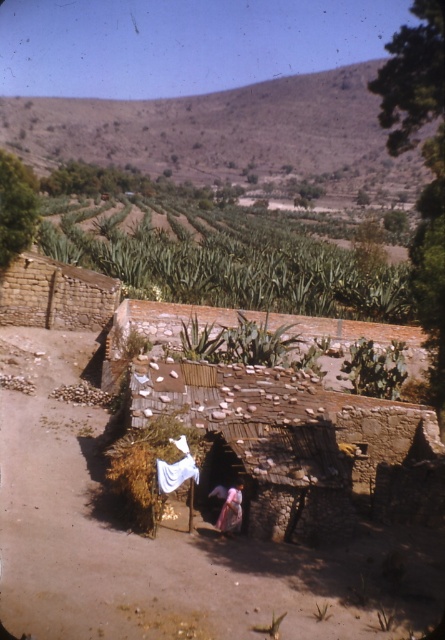
Between brown dirt track at center and rustic stone hut at center, which one appears on the left side from the viewer's perspective?

From the viewer's perspective, brown dirt track at center appears more on the left side.

Can you confirm if brown dirt track at center is positioned below rustic stone hut at center?

Yes.

Image resolution: width=445 pixels, height=640 pixels. Identify the location of brown dirt track at center. (165, 540).

Where is `brown dirt track at center`? brown dirt track at center is located at coordinates (165, 540).